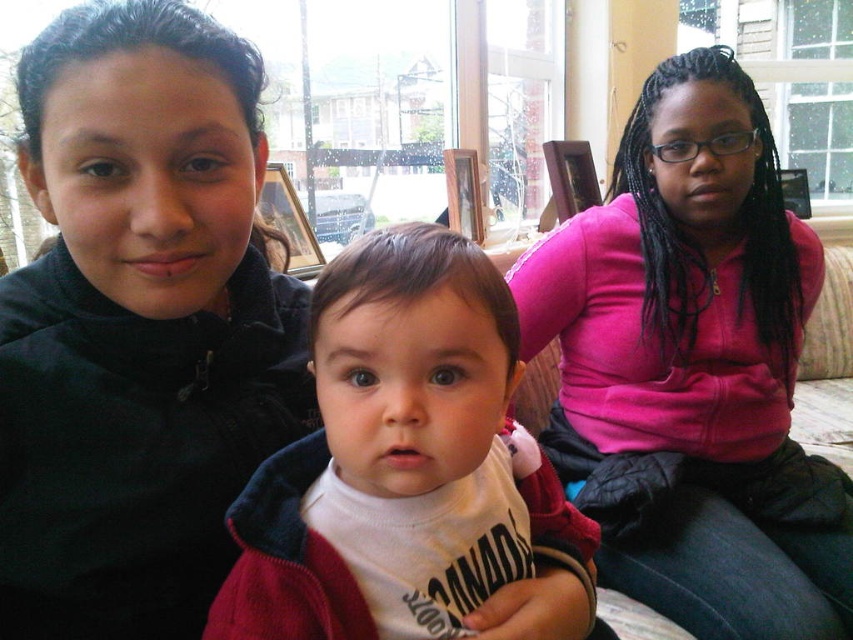
What is located at the coordinates point (693, 369) in the image?

The pink fleece at center is located at point (693, 369).

You are a photographer trying to capture a closeup of the baby in the white shirt with Canada printed on it. You need to adjust your camera focus to the exact center of the pink fleece at center. What coordinates should you set your focus to?

You should set the focus coordinates to (693, 369) because the pink fleece at center is located at that position.

You are a photographer setting up for a family photo in the living room. You need to position a pink fleece and a white soft fabric so that the pink fleece is closer to the camera. Based on the scene description, are the current positions of the pink fleece at center and white soft fabric at center suitable for your setup?

Yes, the current positions are suitable because the pink fleece at center is already further to the viewer than the white soft fabric at center, meaning it is closer to the camera as required.